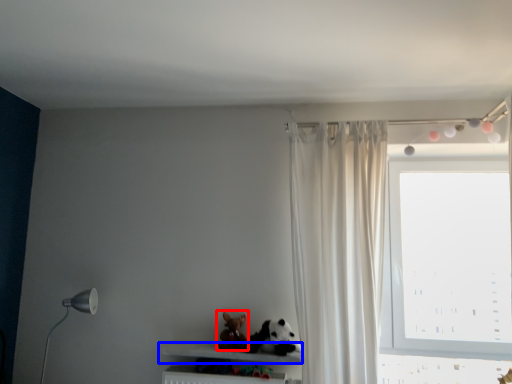
Question: Which object is closer to the camera taking this photo, toy (highlighted by a red box) or shelf (highlighted by a blue box)?

Choices:
 (A) toy
 (B) shelf

Answer: (B)